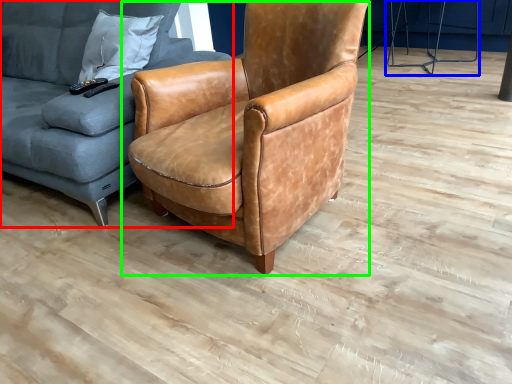
Question: Which is farther away from studio couch (highlighted by a red box)? half (highlighted by a blue box) or chair (highlighted by a green box)?

Choices:
 (A) half
 (B) chair

Answer: (A)